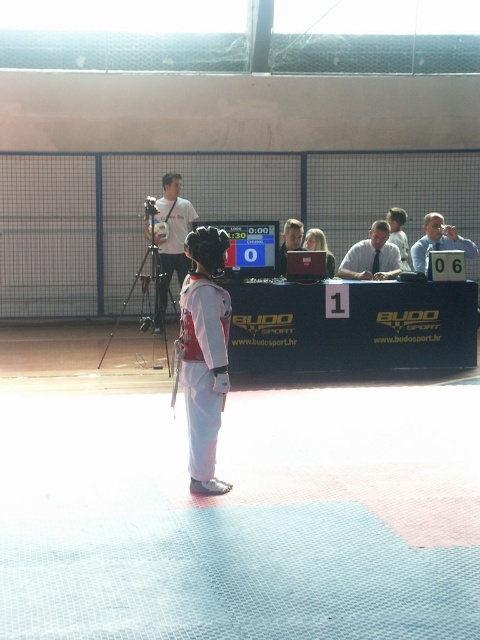
You are a photographer at the martial arts competition. You need to capture a clear photo of the competitor with the light brown hair at upper center. The white matte camera at upper center is available. Is the camera positioned in a way that allows you to capture the competitor without obstruction?

The white matte camera at upper center is located above the light brown hair at upper center, so the camera is positioned above the competitor. This should allow you to capture the competitor without obstruction as the camera is above and not blocking the view.

You are a judge at a martial arts competition. You need to determine if the light blue shirt at right is taller than the smooth skin face at center. Based on the scene, what is your ruling?

The light blue shirt at right has a greater height compared to the smooth skin face at center, so the ruling would be that the light blue shirt at right is indeed taller than the smooth skin face at center.